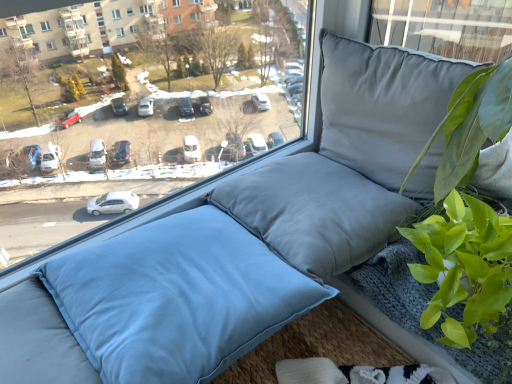
Question: Can you see satin gray pillow at center, which ranks as the 2th pillow in bottom-to-top order, touching gray fabric pillow at upper right, placed as the third pillow when sorted from bottom to top?

Choices:
 (A) yes
 (B) no

Answer: (B)

Question: Does satin gray pillow at center, arranged as the second pillow when viewed from the top, turn towards gray fabric pillow at upper right, placed as the third pillow when sorted from bottom to top?

Choices:
 (A) no
 (B) yes

Answer: (A)

Question: Can you confirm if satin gray pillow at center, which ranks as the 2th pillow in bottom-to-top order, is wider than gray fabric pillow at upper right, placed as the third pillow when sorted from bottom to top?

Choices:
 (A) yes
 (B) no

Answer: (A)

Question: Is gray fabric pillow at upper right, placed as the third pillow when sorted from bottom to top, located within satin gray pillow at center, arranged as the second pillow when viewed from the top?

Choices:
 (A) no
 (B) yes

Answer: (A)

Question: From the image's perspective, would you say satin gray pillow at center, which ranks as the 2th pillow in bottom-to-top order, is positioned over gray fabric pillow at upper right, arranged as the first pillow when viewed from the top?

Choices:
 (A) yes
 (B) no

Answer: (B)

Question: Are satin gray pillow at center, which ranks as the 2th pillow in bottom-to-top order, and gray fabric pillow at upper right, arranged as the first pillow when viewed from the top, far apart?

Choices:
 (A) yes
 (B) no

Answer: (B)

Question: Considering the relative sizes of satin gray pillow at center, which ranks as the 2th pillow in bottom-to-top order, and matte gray cushion at center in the image provided, is satin gray pillow at center, which ranks as the 2th pillow in bottom-to-top order, smaller than matte gray cushion at center?

Choices:
 (A) yes
 (B) no

Answer: (A)

Question: Can you confirm if satin gray pillow at center, arranged as the second pillow when viewed from the top, is shorter than matte gray cushion at center?

Choices:
 (A) yes
 (B) no

Answer: (A)

Question: From the image's perspective, does satin gray pillow at center, which ranks as the 2th pillow in bottom-to-top order, appear lower than matte gray cushion at center?

Choices:
 (A) no
 (B) yes

Answer: (B)

Question: Does satin gray pillow at center, arranged as the second pillow when viewed from the top, have a greater width compared to matte gray cushion at center?

Choices:
 (A) yes
 (B) no

Answer: (A)

Question: From a real-world perspective, is satin gray pillow at center, arranged as the second pillow when viewed from the top, located higher than matte gray cushion at center?

Choices:
 (A) no
 (B) yes

Answer: (A)

Question: Is satin gray pillow at center, which ranks as the 2th pillow in bottom-to-top order, not inside matte gray cushion at center?

Choices:
 (A) yes
 (B) no

Answer: (A)

Question: Can you confirm if matte gray cushion at center is shorter than satin gray pillow at center, which ranks as the 2th pillow in bottom-to-top order?

Choices:
 (A) no
 (B) yes

Answer: (A)